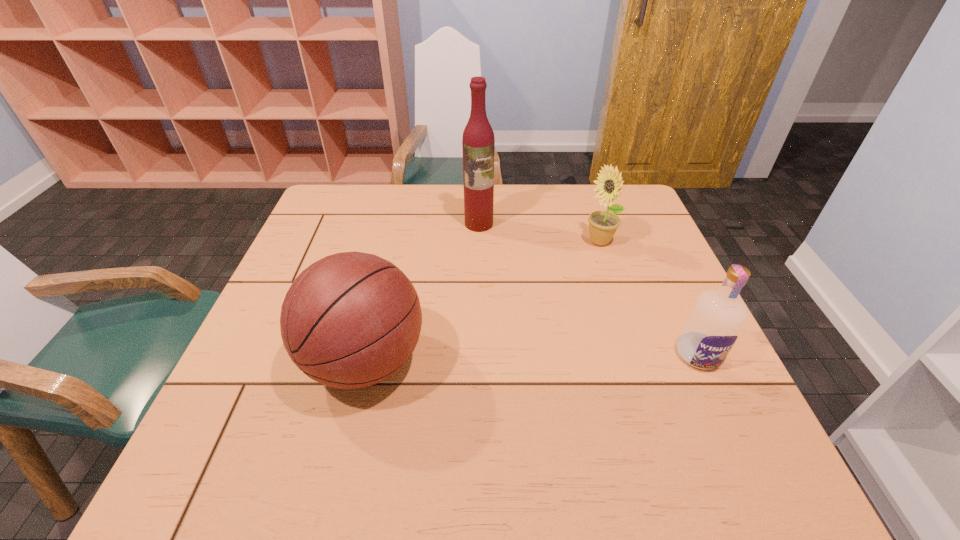
This screenshot has height=540, width=960. Find the location of `basketball`. basketball is located at coordinates (350, 320).

The image size is (960, 540). I want to click on vodka, so click(713, 325).

This screenshot has width=960, height=540. Identify the location of the second object from right to left. (602, 224).

Identify the location of sunflower. (602, 224).

This screenshot has width=960, height=540. I want to click on liquor, so click(478, 143).

Where is `the farthest object`? Image resolution: width=960 pixels, height=540 pixels. the farthest object is located at coordinates (478, 143).

I want to click on blank area located 0.400m on the right of the leftmost object, so click(612, 361).

Image resolution: width=960 pixels, height=540 pixels. I want to click on free spot located on the label of the vodka, so click(724, 411).

At what (x,y) coordinates should I click in order to perform the action: click on vacant space located on the face of the sunflower. Please return your answer as a coordinate pair (x, y). The width and height of the screenshot is (960, 540). Looking at the image, I should click on (568, 296).

The width and height of the screenshot is (960, 540). In order to click on vacant space situated on the face of the sunflower in this screenshot , I will do `click(548, 327)`.